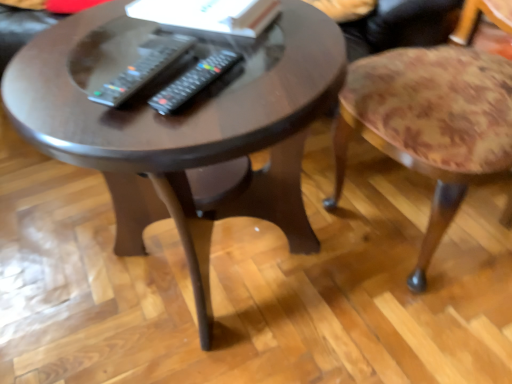
The image size is (512, 384). What are the coordinates of `vacant space situated on the left part of dark wood coffee table at center` in the screenshot? It's located at 51,245.